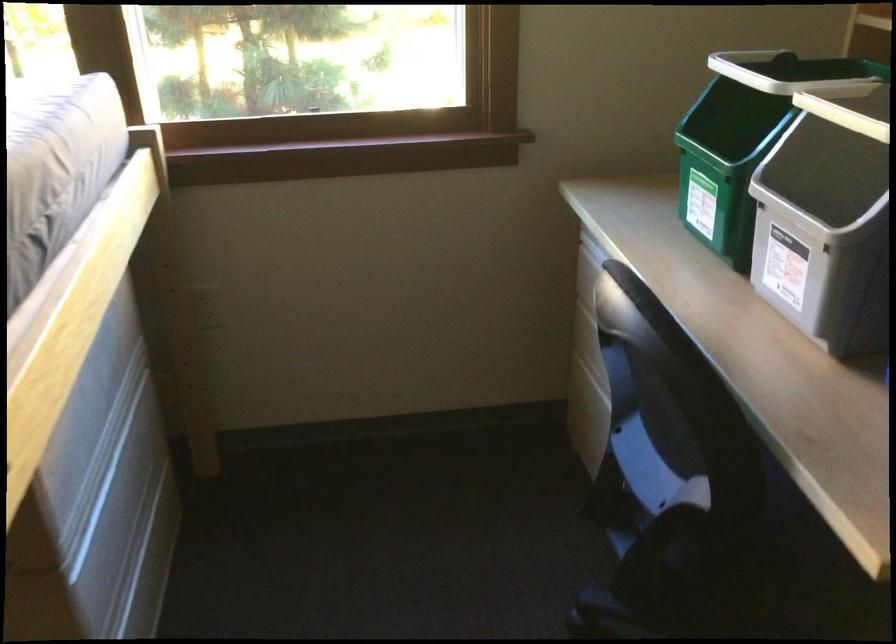
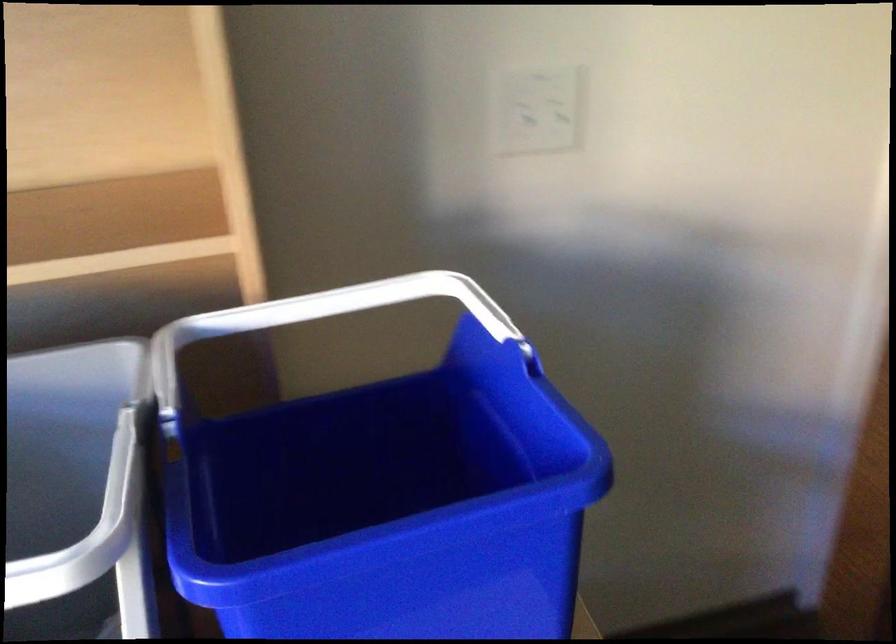
The images are taken continuously from a first-person perspective. In which direction is your viewpoint rotating?

The camera rotated toward right-down.